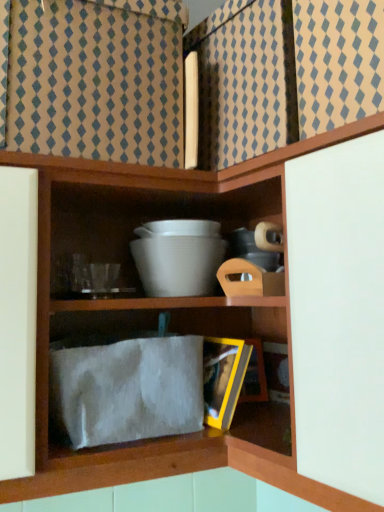
Question: Is white matte bowl at center turned away from white fuzzy cloth at lower center?

Choices:
 (A) yes
 (B) no

Answer: (B)

Question: Is white matte bowl at center not inside white fuzzy cloth at lower center?

Choices:
 (A) yes
 (B) no

Answer: (A)

Question: From the image's perspective, would you say white matte bowl at center is positioned over white fuzzy cloth at lower center?

Choices:
 (A) yes
 (B) no

Answer: (A)

Question: Can you confirm if white matte bowl at center is positioned to the right of white fuzzy cloth at lower center?

Choices:
 (A) no
 (B) yes

Answer: (B)

Question: Can you confirm if white matte bowl at center is taller than white fuzzy cloth at lower center?

Choices:
 (A) no
 (B) yes

Answer: (A)

Question: Is white matte bowl at center smaller than white fuzzy cloth at lower center?

Choices:
 (A) no
 (B) yes

Answer: (B)

Question: Considering the relative sizes of white fuzzy cloth at lower center and white matte bowl at center in the image provided, is white fuzzy cloth at lower center shorter than white matte bowl at center?

Choices:
 (A) yes
 (B) no

Answer: (B)

Question: From a real-world perspective, is white fuzzy cloth at lower center physically above white matte bowl at center?

Choices:
 (A) yes
 (B) no

Answer: (B)

Question: From the image's perspective, is white fuzzy cloth at lower center located above white matte bowl at center?

Choices:
 (A) yes
 (B) no

Answer: (B)

Question: Is white fuzzy cloth at lower center turned away from white matte bowl at center?

Choices:
 (A) yes
 (B) no

Answer: (B)

Question: Is white fuzzy cloth at lower center completely or partially outside of white matte bowl at center?

Choices:
 (A) no
 (B) yes

Answer: (B)

Question: Does white fuzzy cloth at lower center turn towards white matte bowl at center?

Choices:
 (A) no
 (B) yes

Answer: (A)

Question: Looking at the image, does white fuzzy cloth at lower center seem bigger or smaller compared to white matte bowl at center?

Choices:
 (A) small
 (B) big

Answer: (B)